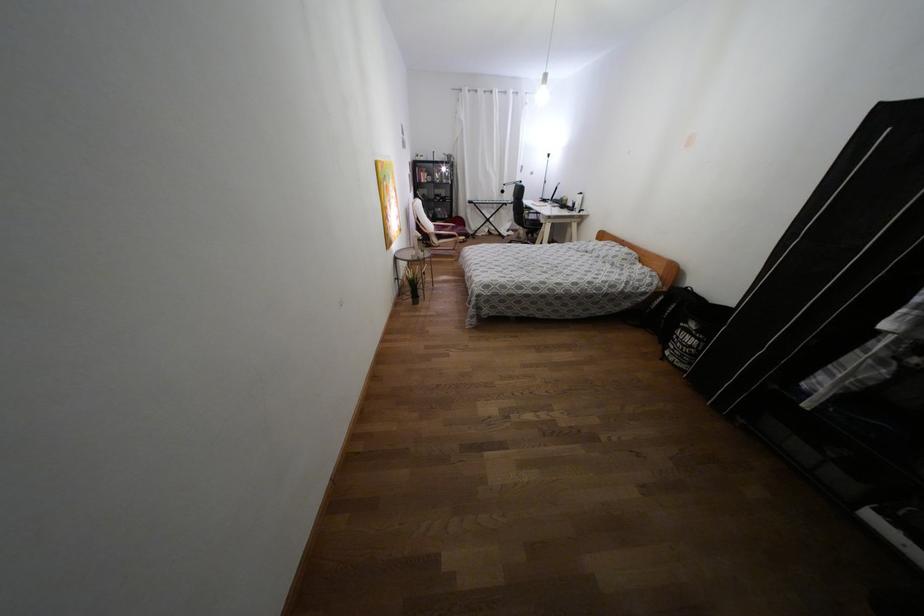
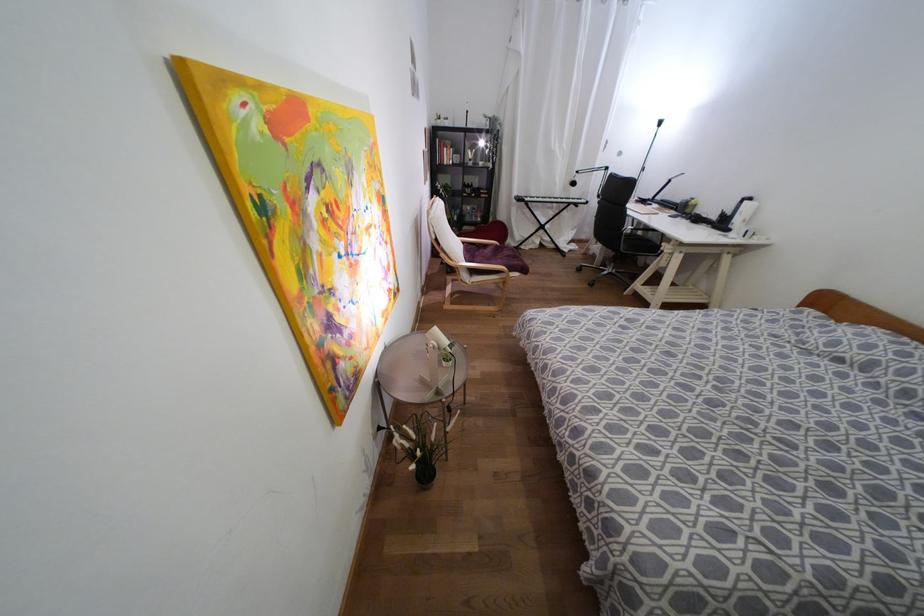
The point at (502, 191) is marked in the first image. Where is the corresponding point in the second image?

(573, 183)